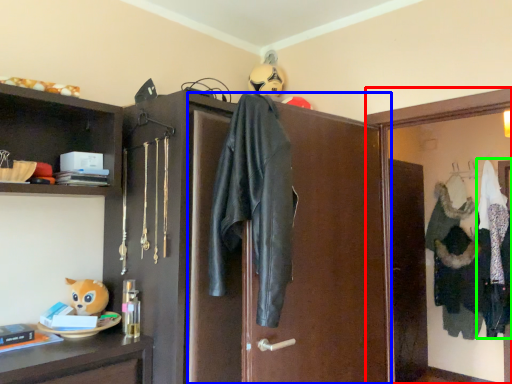
Question: Which is nearer to the medicine cabinet (highlighted by a red box)? screen door (highlighted by a blue box) or clothing (highlighted by a green box).

Choices:
 (A) screen door
 (B) clothing

Answer: (A)